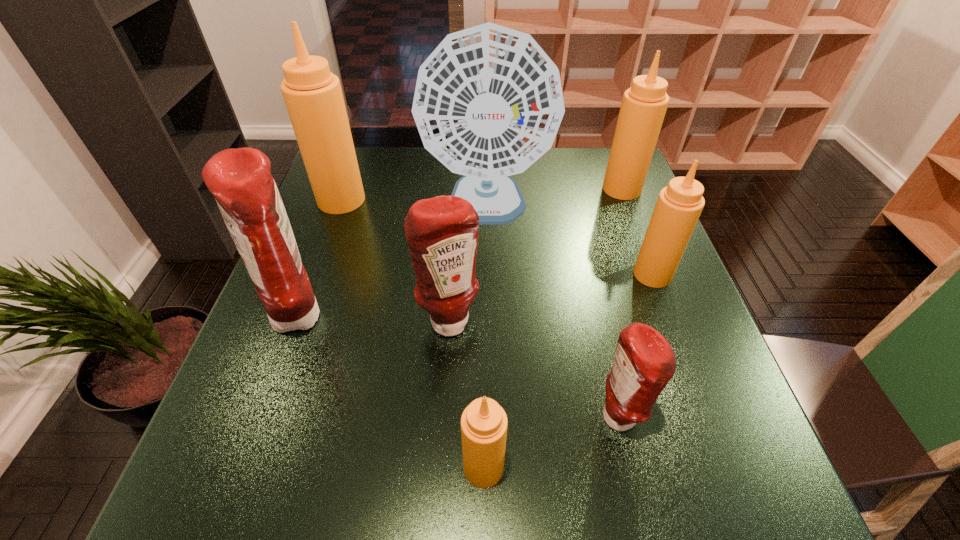
Locate an element on the screen. the nearest tan condiment is located at coordinates [484, 423].

The height and width of the screenshot is (540, 960). Find the location of `the smallest tan condiment`. the smallest tan condiment is located at coordinates (484, 423).

Locate an element on the screen. Image resolution: width=960 pixels, height=540 pixels. free spot located on the grille of the fan is located at coordinates (488, 286).

I want to click on blank space located on the right of the biggest tan condiment, so click(412, 200).

At what (x,y) coordinates should I click in order to perform the action: click on blank space located 0.150m on the front of the second biggest tan condiment. Please return your answer as a coordinate pair (x, y). This screenshot has width=960, height=540. Looking at the image, I should click on 639,236.

The width and height of the screenshot is (960, 540). In order to click on vacant space located 0.240m on the front of the biggest red condiment in this screenshot , I will do `click(244, 469)`.

This screenshot has width=960, height=540. I want to click on free location located 0.310m on the right of the second red condiment from right to left, so click(627, 321).

Locate an element on the screen. The image size is (960, 540). free spot located on the left of the third biggest tan condiment is located at coordinates (526, 274).

Identify the location of free location located 0.180m on the back of the third condiment from right to left. (594, 316).

Where is `vacant position located 0.230m on the right of the smallest tan condiment`? vacant position located 0.230m on the right of the smallest tan condiment is located at coordinates (645, 468).